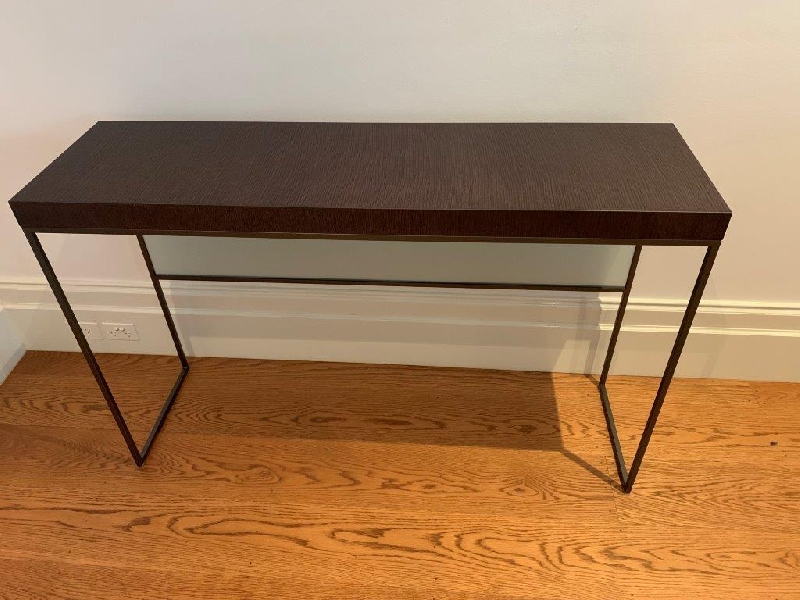
You are a GUI agent. You are given a task and a screenshot of the screen. Output one action in this format:
    pyautogui.click(x=<x>, y=<y>)
    Task: Click on the white surrounding outlet
    
    Given the screenshot: What is the action you would take?
    pyautogui.click(x=105, y=325)